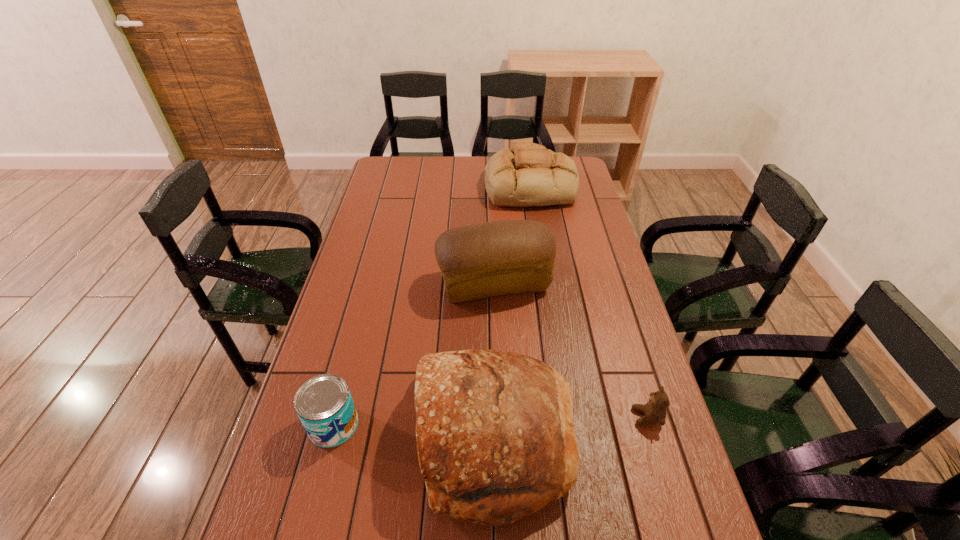
The width and height of the screenshot is (960, 540). I want to click on object that is at the far right corner, so click(528, 175).

At what (x,y) coordinates should I click in order to perform the action: click on free space at the far edge. Please return your answer as a coordinate pair (x, y). This screenshot has height=540, width=960. Looking at the image, I should click on (416, 175).

Where is `free space at the left edge of the desktop`? This screenshot has height=540, width=960. free space at the left edge of the desktop is located at coordinates (327, 322).

In the image, there is a desktop. Where is `vacant space at the right edge`? vacant space at the right edge is located at coordinates (565, 208).

You are a GUI agent. You are given a task and a screenshot of the screen. Output one action in this format:
    pyautogui.click(x=<x>, y=<y>)
    Task: Click on the vacant space at the far left corner of the desktop
    The width and height of the screenshot is (960, 540).
    Given the screenshot: What is the action you would take?
    pyautogui.click(x=412, y=159)

Find the location of a particular element. This screenshot has height=540, width=960. free spot between the teddy bear and the farthest bread is located at coordinates (588, 302).

Where is `free space between the can and the second farthest bread`? The height and width of the screenshot is (540, 960). free space between the can and the second farthest bread is located at coordinates (414, 354).

I want to click on free space between the nearest bread and the farthest object, so click(514, 312).

Where is `object that is the fourth closest to the can`? object that is the fourth closest to the can is located at coordinates (528, 175).

Select which object is the closest to the shortest bread. Please provide its 2D coordinates. Your answer should be formatted as a tuple, i.e. [(x, y)], where the tuple contains the x and y coordinates of a point satisfying the conditions above.

[(500, 257)]